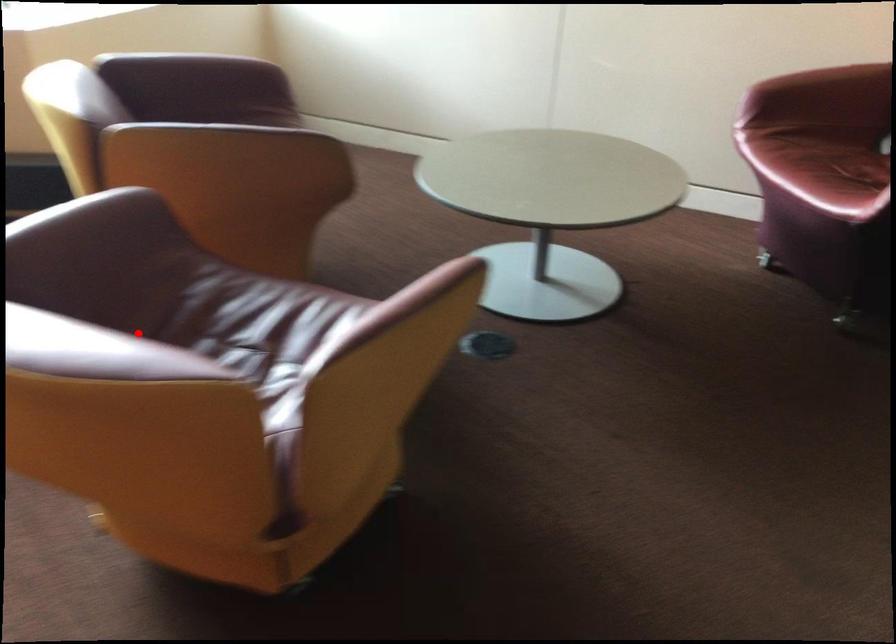
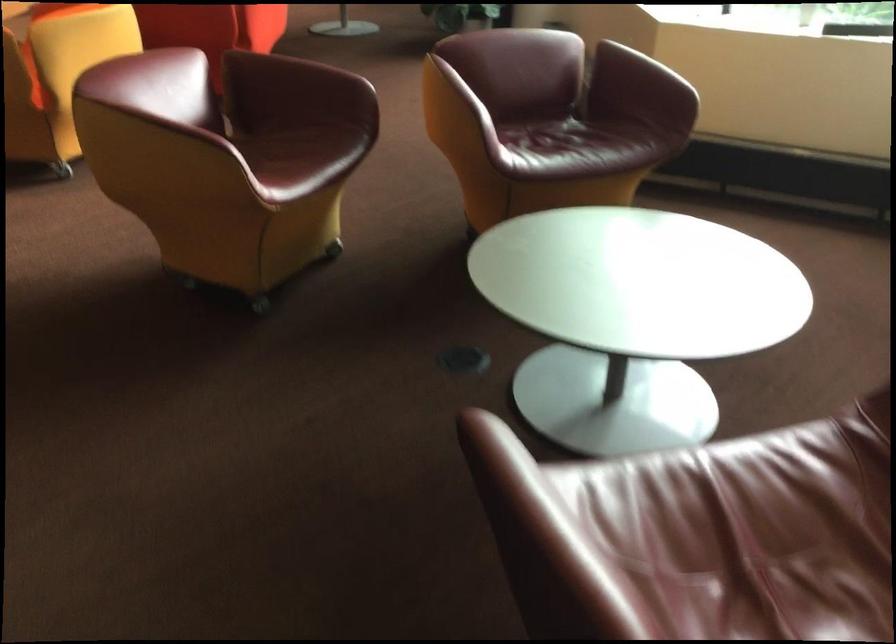
Question: A red point is marked in image1. In image2, is the corresponding 3D point closer to the camera or farther? Reply with the corresponding letter.

Choices:
 (A) The corresponding 3D point is closer.
 (B) The corresponding 3D point is farther.

Answer: (B)